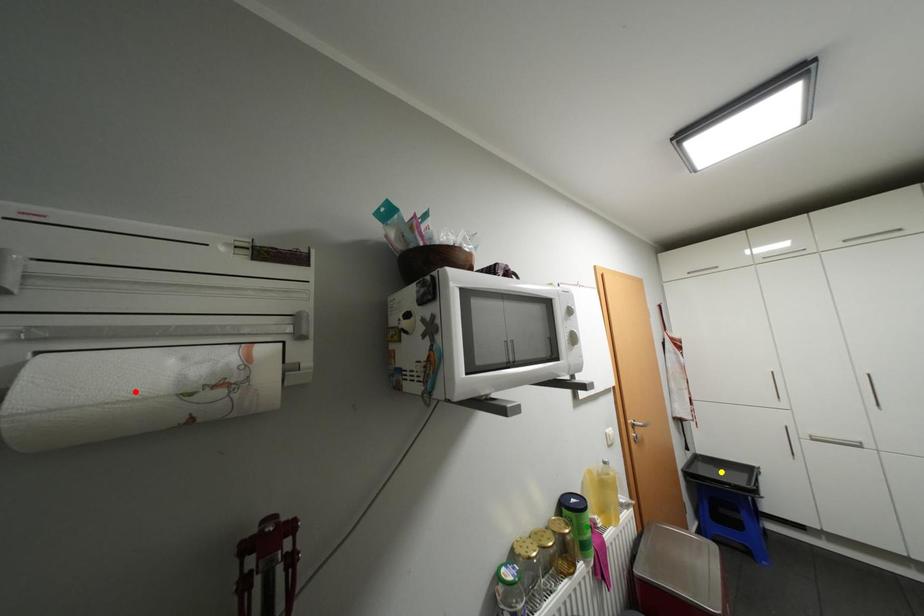
Order these from nearest to farthest:
yellow point
red point
green point

1. red point
2. green point
3. yellow point